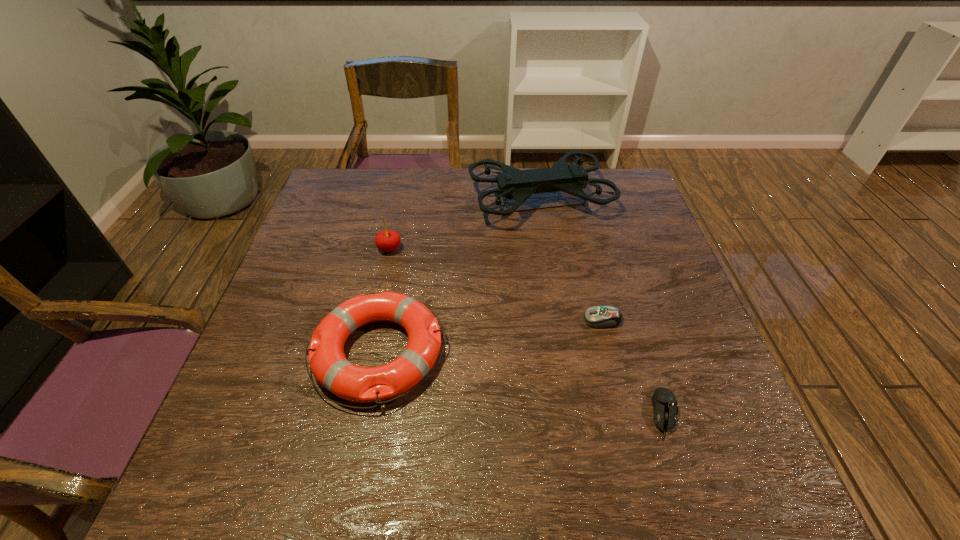
Find the location of a particular element. free area in between the right computer mouse and the left computer mouse is located at coordinates (634, 367).

You are a GUI agent. You are given a task and a screenshot of the screen. Output one action in this format:
    pyautogui.click(x=<x>, y=<y>)
    Task: Click on the vacant space in between the left computer mouse and the tallest object
    The height and width of the screenshot is (540, 960).
    Given the screenshot: What is the action you would take?
    pyautogui.click(x=571, y=259)

Locate an element on the screen. vacant area that lies between the third shortest object and the farthest object is located at coordinates (460, 275).

Where is `vacant space that's between the tallest object and the farther computer mouse`? vacant space that's between the tallest object and the farther computer mouse is located at coordinates (571, 259).

Locate an element on the screen. The width and height of the screenshot is (960, 540). empty space that is in between the tallest object and the life buoy is located at coordinates (460, 275).

Locate which object ranks second in proximity to the tallest object. Please provide its 2D coordinates. Your answer should be formatted as a tuple, i.e. [(x, y)], where the tuple contains the x and y coordinates of a point satisfying the conditions above.

[(329, 365)]

The image size is (960, 540). Identify the location of object that can be found as the third closest to the third shortest object. (596, 316).

The height and width of the screenshot is (540, 960). Identify the location of free spot that satisfies the following two spatial constraints: 1. on the wheel side of the farther computer mouse; 2. on the left side of the shorter computer mouse. (626, 414).

Find the location of a particular element. The width and height of the screenshot is (960, 540). free spot that satisfies the following two spatial constraints: 1. on the wheel side of the nearer computer mouse; 2. on the right side of the farther computer mouse is located at coordinates (626, 414).

Identify the location of vacant position in the image that satisfies the following two spatial constraints: 1. on the back side of the drone; 2. on the left side of the life buoy. The height and width of the screenshot is (540, 960). (409, 199).